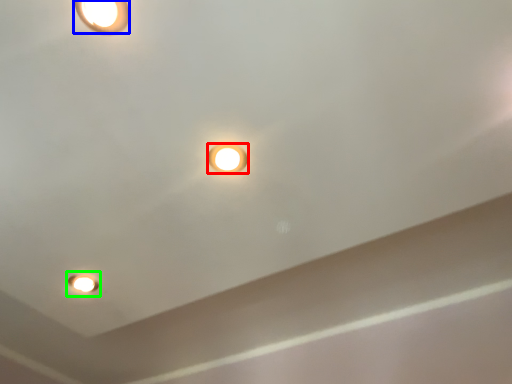
Question: Which object is positioned farthest from lamp (highlighted by a red box)? Select from lamp (highlighted by a blue box) and light fixture (highlighted by a green box).

Choices:
 (A) lamp
 (B) light fixture

Answer: (B)